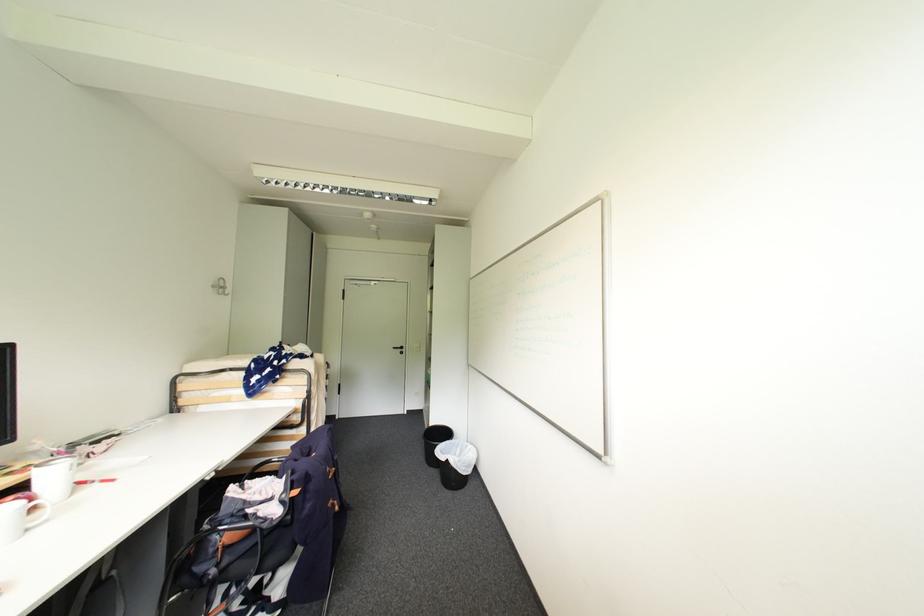
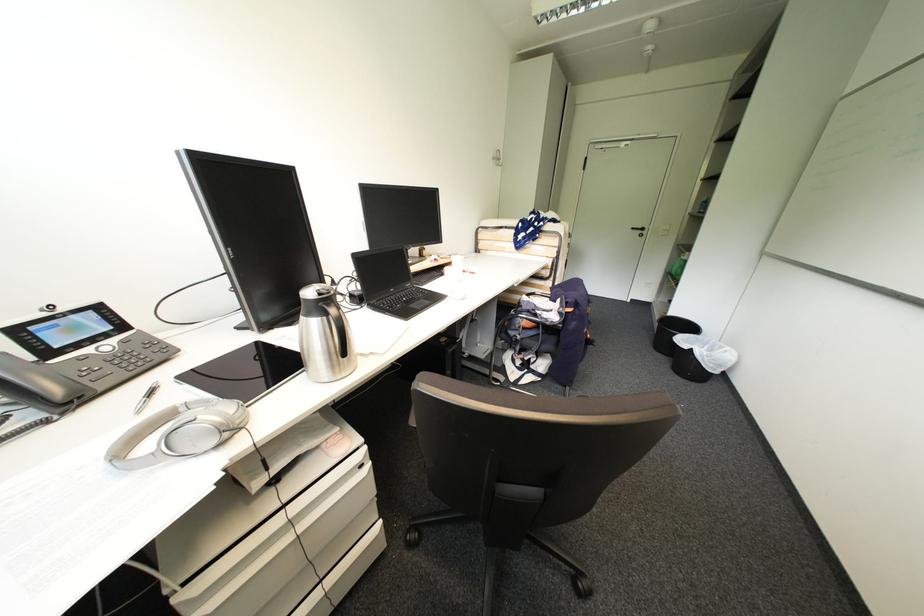
The point at (433, 467) is marked in the first image. Where is the corresponding point in the second image?

(660, 351)